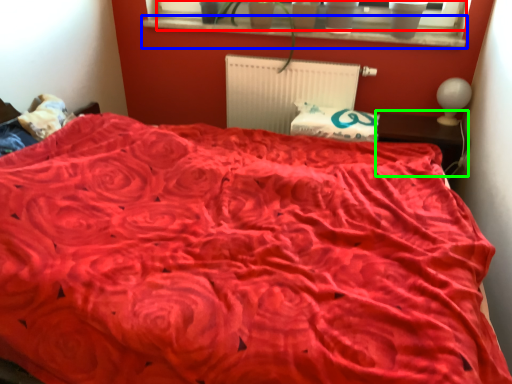
Question: Estimate the real-world distances between objects in this image. Which object is closer to window screen (highlighted by a red box), window sill (highlighted by a blue box) or table (highlighted by a green box)?

Choices:
 (A) window sill
 (B) table

Answer: (A)